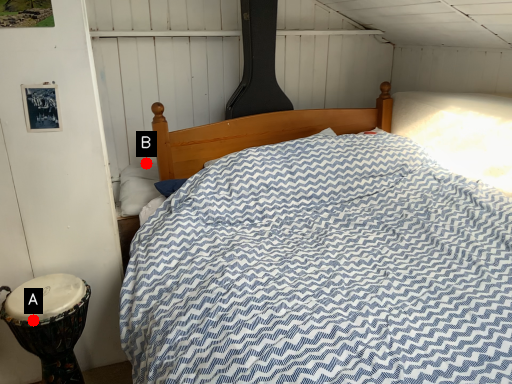
Question: Two points are circled on the image, labeled by A and B beside each circle. Which point is farther from the camera taking this photo?

Choices:
 (A) A is further
 (B) B is further

Answer: (B)